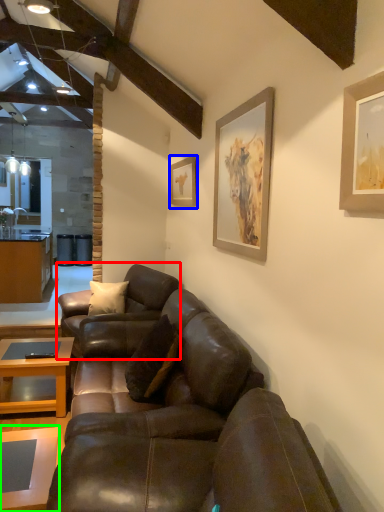
Question: Estimate the real-world distances between objects in this image. Which object is farther from studio couch (highlighted by a red box), picture frame (highlighted by a blue box) or coffee table (highlighted by a green box)?

Choices:
 (A) picture frame
 (B) coffee table

Answer: (B)